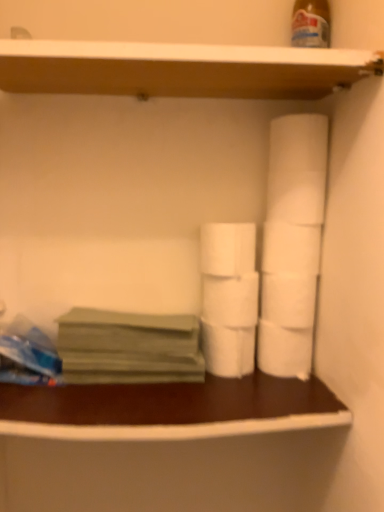
At what (x,y) coordinates should I click in order to perform the action: click on free spot in front of green matte paper at left. Please return your answer as a coordinate pair (x, y). The height and width of the screenshot is (512, 384). Looking at the image, I should click on (125, 401).